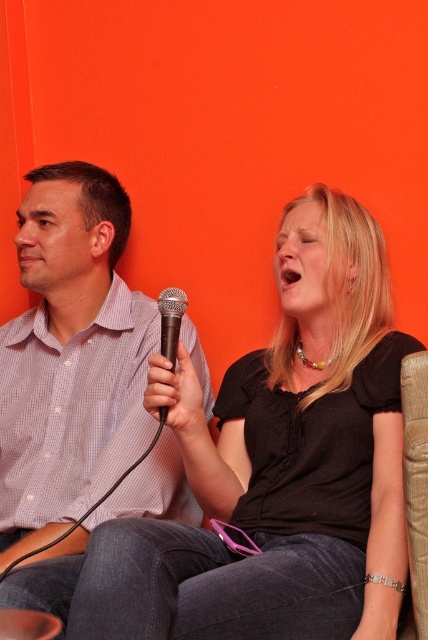
Is checkered fabric shirt at left bigger than black metallic microphone at center?

Yes.

Identify the location of checkered fabric shirt at left. (71, 356).

Measure the distance between point (x=2, y=528) and camera.

Point (x=2, y=528) is 1.44 meters away from camera.

The width and height of the screenshot is (428, 640). What are the coordinates of `checkered fabric shirt at left` in the screenshot? It's located at (71, 356).

Can you confirm if matte black microphone at center is thinner than checkered fabric shirt at left?

Incorrect, matte black microphone at center's width is not less than checkered fabric shirt at left's.

Does matte black microphone at center have a greater width compared to checkered fabric shirt at left?

Indeed, matte black microphone at center has a greater width compared to checkered fabric shirt at left.

The width and height of the screenshot is (428, 640). In order to click on matte black microphone at center in this screenshot , I will do `click(276, 467)`.

Between matte black microphone at center and black metallic microphone at center, which one is positioned higher?

Positioned higher is black metallic microphone at center.

Which of these two, matte black microphone at center or black metallic microphone at center, stands shorter?

With less height is black metallic microphone at center.

Between point (398, 365) and point (169, 312), which one is positioned behind?

Positioned behind is point (398, 365).

Find the location of a particular element. This screenshot has width=428, height=640. matte black microphone at center is located at coordinates (276, 467).